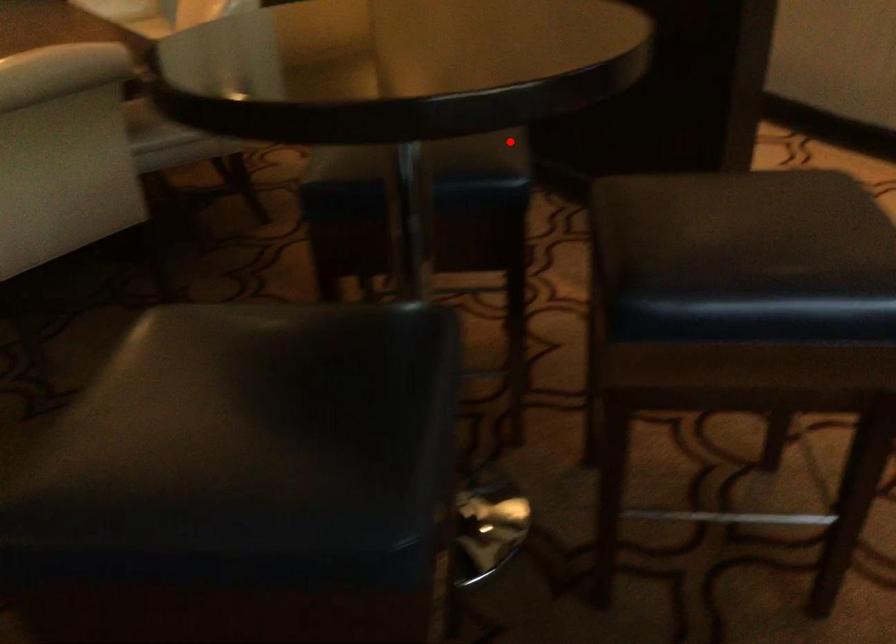
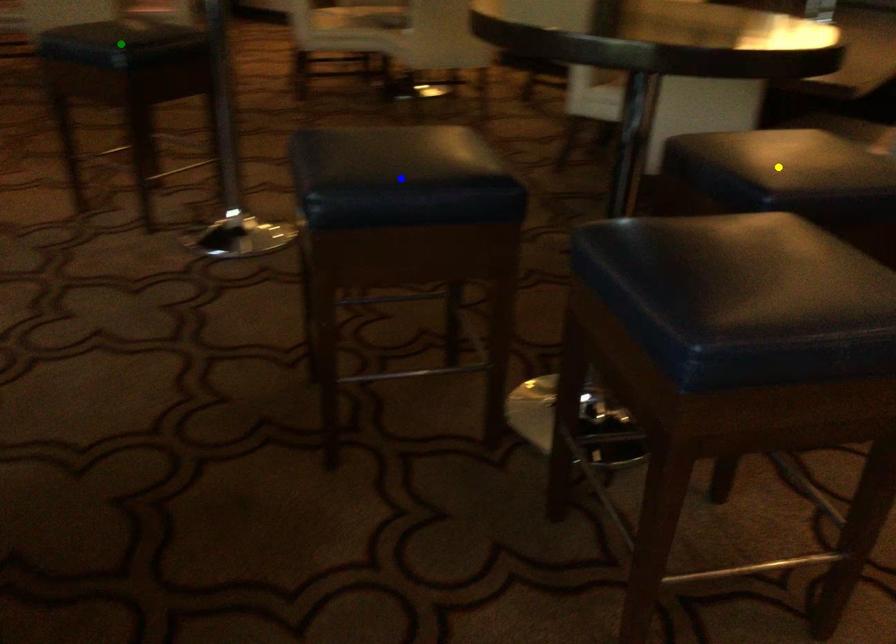
Question: I am providing you with two images of the same scene from different viewpoints. A red point is marked on the first image. You are given multiple points on the second image. Which spot in image 2 lines up with the point in image 1?

Choices:
 (A) blue point
 (B) yellow point
 (C) green point

Answer: (B)